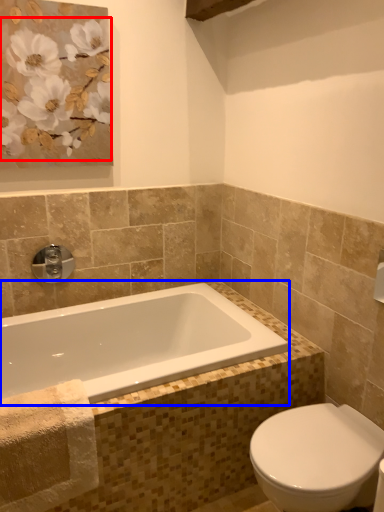
Question: Which point is closer to the camera, flower (highlighted by a red box) or bathtub (highlighted by a blue box)?

Choices:
 (A) flower
 (B) bathtub

Answer: (B)